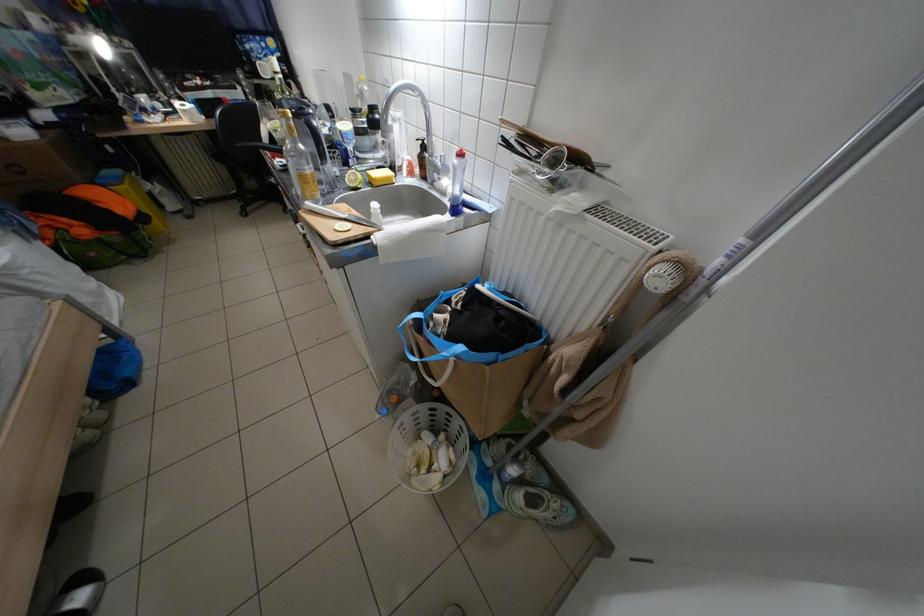
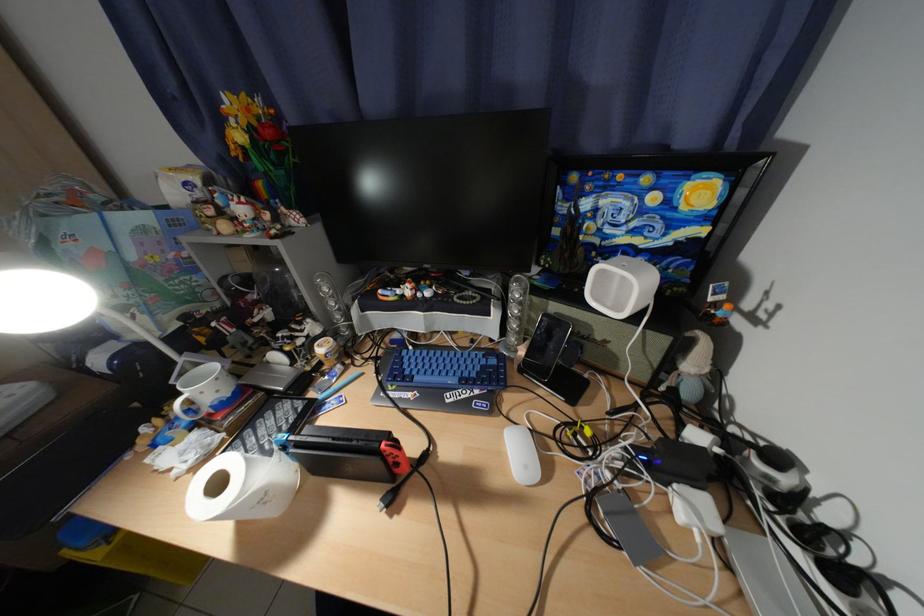
In the second image, find the point that corresponds to the point at 307,92 in the first image.

(704, 367)